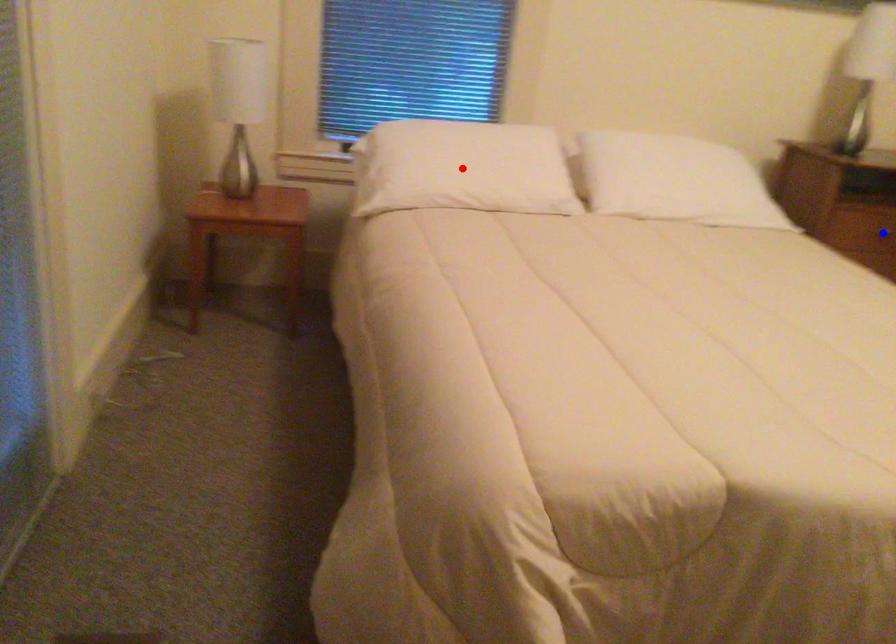
Question: In the image, two points are highlighted. Which point is nearer to the camera? Reply with the corresponding letter.

Choices:
 (A) blue point
 (B) red point

Answer: (B)